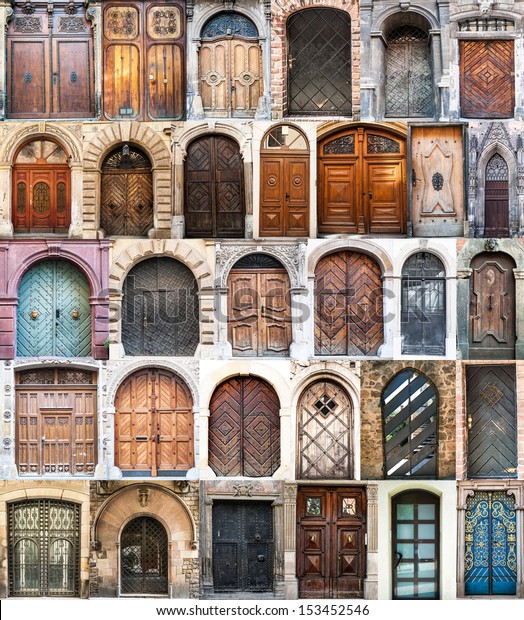
Where is `doors in leftmost and rightmost columns`? doors in leftmost and rightmost columns is located at coordinates pos(30,99), pos(28,198), pos(40,317), pos(41,414), pos(23,531), pos(507,529), pos(498,420), pos(499,304), pos(497,208), pos(495,108).